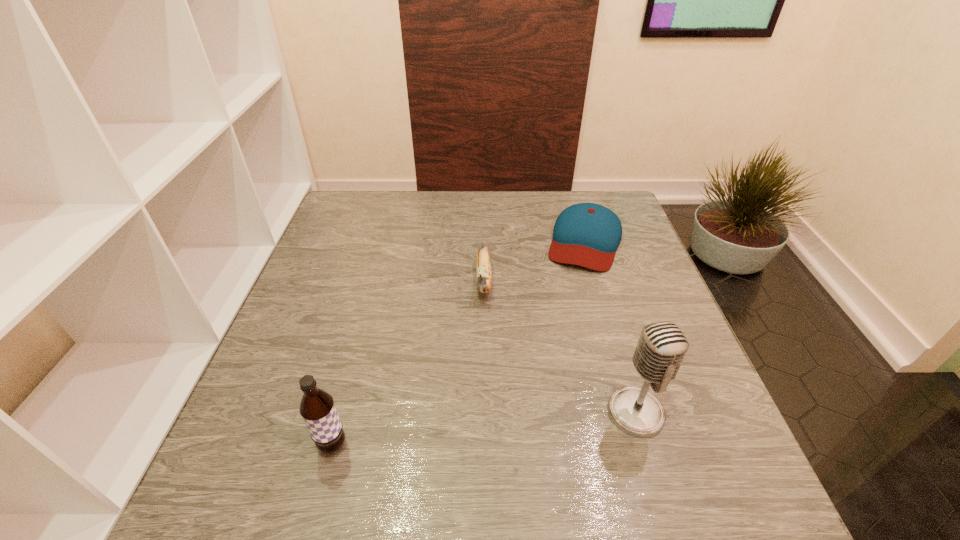
I want to click on free space on the desktop that is between the root beer and the tallest object and is positioned with the bill of the shortest object facing forward, so coord(531,424).

Locate an element on the screen. Image resolution: width=960 pixels, height=540 pixels. free spot on the desktop that is between the leftmost object and the tallest object and is positioned at the stem of the second object from left to right is located at coordinates (479, 430).